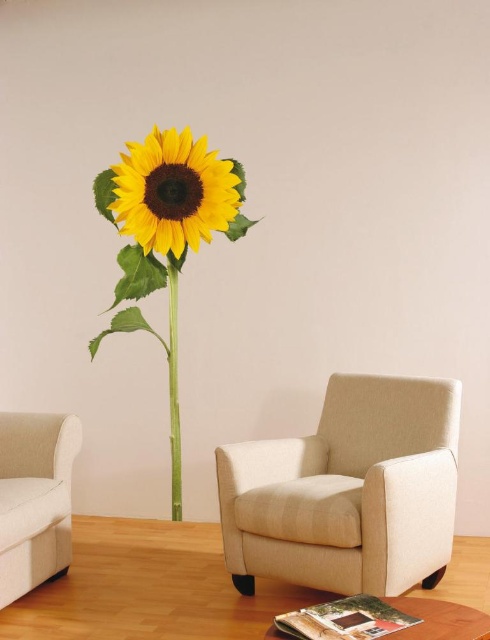
Between beige fabric couch at left and wooden round table at lower center, which one appears on the right side from the viewer's perspective?

From the viewer's perspective, wooden round table at lower center appears more on the right side.

Can you confirm if beige fabric couch at left is thinner than wooden round table at lower center?

Yes, beige fabric couch at left is thinner than wooden round table at lower center.

Between point (55, 486) and point (294, 628), which one is positioned in front?

Point (294, 628) is in front.

Locate an element on the screen. beige fabric couch at left is located at coordinates (34, 499).

Can you confirm if yellow matte sunflower at upper center is thinner than green matte stem at center?

Incorrect, yellow matte sunflower at upper center's width is not less than green matte stem at center's.

Can you confirm if yellow matte sunflower at upper center is wider than green matte stem at center?

Yes.

Which is in front, point (117, 189) or point (175, 477)?

Point (117, 189) is in front.

This screenshot has width=490, height=640. What are the coordinates of `yellow matte sunflower at upper center` in the screenshot? It's located at (172, 193).

Identify the location of beige fabric armchair at center. (347, 492).

Which is behind, point (236, 456) or point (173, 508)?

The point (173, 508) is behind.

Does point (318, 502) lie in front of point (171, 262)?

Yes.

At what (x,y) coordinates should I click in order to perform the action: click on beige fabric armchair at center. Please return your answer as a coordinate pair (x, y). This screenshot has height=640, width=490. Looking at the image, I should click on (347, 492).